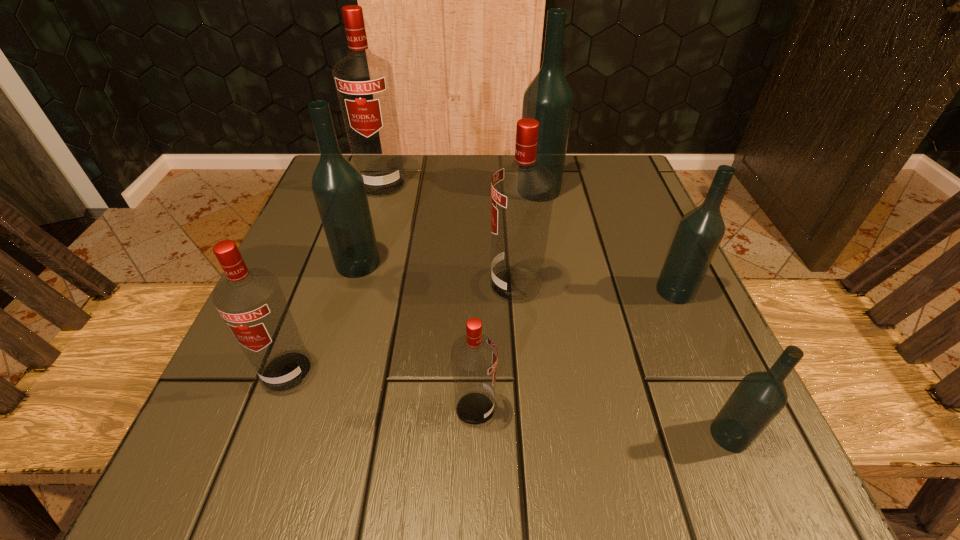
The image size is (960, 540). Find the location of `empty space that is in between the third nearest red vodka and the second biggest black vodka`. empty space that is in between the third nearest red vodka and the second biggest black vodka is located at coordinates tap(437, 274).

This screenshot has height=540, width=960. I want to click on free space between the second biggest red vodka and the second smallest red vodka, so click(x=401, y=328).

You are a GUI agent. You are given a task and a screenshot of the screen. Output one action in this format:
    pyautogui.click(x=<x>, y=<y>)
    Task: Click on the free spot between the smallest red vodka and the second smallest red vodka
    
    Given the screenshot: What is the action you would take?
    pyautogui.click(x=381, y=390)

The image size is (960, 540). What are the coordinates of `free space between the third biggest black vodka and the smallest black vodka` in the screenshot? It's located at (703, 363).

Where is `vacant space that's between the second smallest red vodka and the third smallest black vodka`? This screenshot has height=540, width=960. vacant space that's between the second smallest red vodka and the third smallest black vodka is located at coordinates (323, 317).

Identify which object is located as the seventh nearest to the third smallest red vodka. Please provide its 2D coordinates. Your answer should be formatted as a tuple, i.e. [(x, y)], where the tuple contains the x and y coordinates of a point satisfying the conditions above.

[(364, 83)]

Locate an element on the screen. The image size is (960, 540). object that is the third closest to the leftmost black vodka is located at coordinates (522, 193).

This screenshot has width=960, height=540. I want to click on the seventh closest vodka relative to the nearest black vodka, so click(x=364, y=83).

Where is `the fifth closest vodka to the third biggest red vodka`? Image resolution: width=960 pixels, height=540 pixels. the fifth closest vodka to the third biggest red vodka is located at coordinates (548, 99).

Select which red vodka is the third closest to the smallest black vodka. Please provide its 2D coordinates. Your answer should be formatted as a tuple, i.e. [(x, y)], where the tuple contains the x and y coordinates of a point satisfying the conditions above.

[(251, 302)]